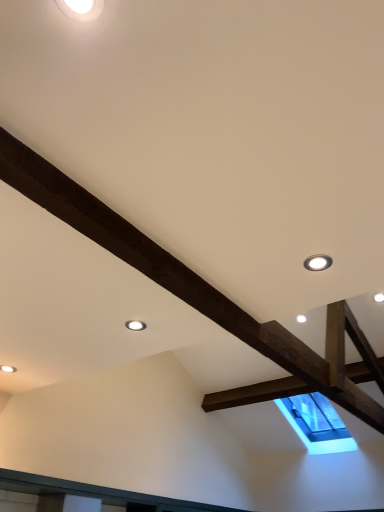
Question: Is white glossy droplight at upper left, which appears as the second droplight when viewed from the right, bigger or smaller than matte white droplight at upper center, the 3th droplight when ordered from top to bottom?

Choices:
 (A) small
 (B) big

Answer: (B)

Question: From a real-world perspective, is white glossy droplight at upper left, placed as the 1th droplight when sorted from top to bottom, above or below matte white droplight at upper center, the first droplight from the bottom?

Choices:
 (A) below
 (B) above

Answer: (B)

Question: Estimate the real-world distances between objects in this image. Which object is closer to the matte white droplight at upper center, which is counted as the 1th droplight, starting from the left?

Choices:
 (A) matte white droplight at upper right, acting as the second droplight starting from the front
 (B) white glossy droplight at upper left, placed as the 1th droplight when sorted from top to bottom

Answer: (A)

Question: Considering the real-world distances, which object is farthest from the white glossy droplight at upper left, positioned as the 2th droplight in left-to-right order?

Choices:
 (A) matte white droplight at upper right, which is counted as the first droplight, starting from the right
 (B) matte white droplight at upper center, the first droplight from the bottom

Answer: (B)